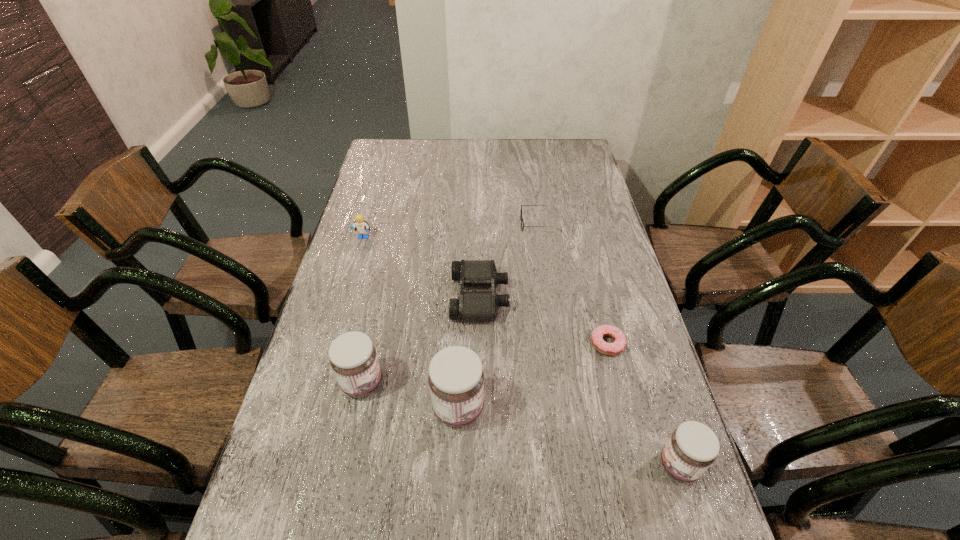
You are a GUI agent. You are given a task and a screenshot of the screen. Output one action in this format:
    pyautogui.click(x=<x>, y=<y>)
    Task: Click on the vacant space located through the lenses of the spectacles
    The image size is (960, 540).
    Given the screenshot: What is the action you would take?
    pyautogui.click(x=475, y=224)

Where is `free point located 0.340m through the eyepieces of the fifth tallest object`? Image resolution: width=960 pixels, height=540 pixels. free point located 0.340m through the eyepieces of the fifth tallest object is located at coordinates (622, 297).

Where is `free point located 0.340m on the front-facing side of the fourth shortest object`? This screenshot has width=960, height=540. free point located 0.340m on the front-facing side of the fourth shortest object is located at coordinates (339, 320).

Where is `blank space located 0.330m on the front of the fourth nearest object`? The width and height of the screenshot is (960, 540). blank space located 0.330m on the front of the fourth nearest object is located at coordinates (644, 489).

The height and width of the screenshot is (540, 960). Identify the location of jam at the left edge. (353, 358).

At what (x,y) coordinates should I click in order to perform the action: click on Lego that is positioned at the left edge. Please return your answer as a coordinate pair (x, y). The height and width of the screenshot is (540, 960). Looking at the image, I should click on (361, 226).

I want to click on jam situated at the right edge, so click(693, 447).

Image resolution: width=960 pixels, height=540 pixels. I want to click on doughnut present at the right edge, so click(x=611, y=349).

Where is `free space at the far edge of the desktop`? The height and width of the screenshot is (540, 960). free space at the far edge of the desktop is located at coordinates coord(496,156).

In the image, there is a desktop. At what (x,y) coordinates should I click in order to perform the action: click on vacant space at the left edge. Please return your answer as a coordinate pair (x, y). This screenshot has width=960, height=540. Looking at the image, I should click on (386, 174).